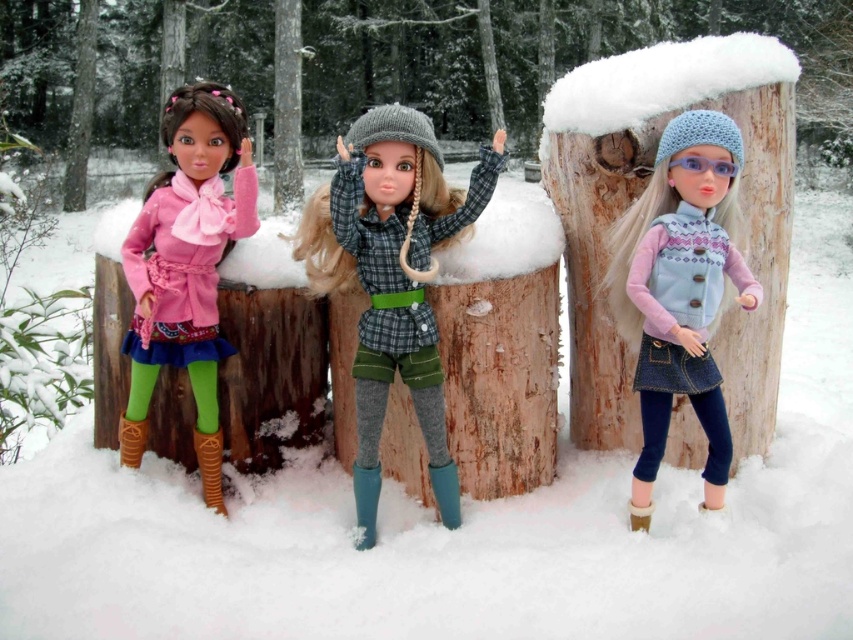
You are a photographer trying to capture a photo of the matte pink coat at left and the brown wood tree trunk at center. Based on their heights, which object should you focus on first to ensure both are in frame?

The matte pink coat at left is much taller than the brown wood tree trunk at center, so you should focus on the matte pink coat at left first to ensure both are in frame.

You are a photographer trying to capture the checkered fabric shirt at center and the brown wood tree trunk at center in the same frame. Which object should you focus on first to ensure both are in the shot?

You should focus on the checkered fabric shirt at center first because it is positioned under the brown wood tree trunk at center, so adjusting the camera angle to include the lower positioned shirt will naturally include the trunk above it.

What are the coordinates of the checkered fabric shirt at center?

The checkered fabric shirt at center is located at coordinates (393,278).